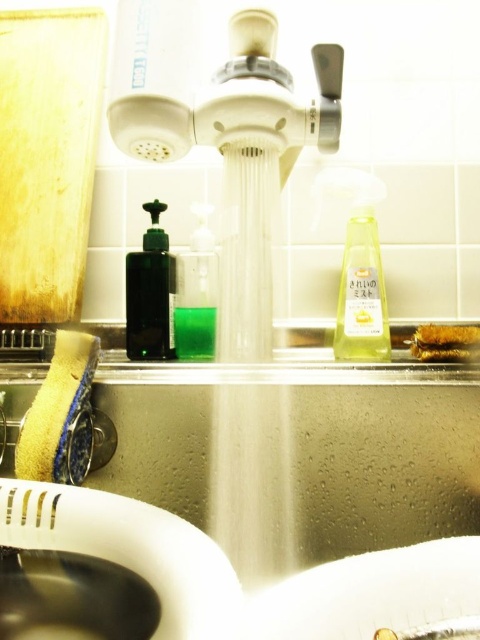
Question: Is metallic stainless steel sink at center above translucent yellow liquid at center?

Choices:
 (A) yes
 (B) no

Answer: (B)

Question: Can you confirm if translucent dark green bottle at center is thinner than green matte liquid at sink center?

Choices:
 (A) yes
 (B) no

Answer: (B)

Question: Which point is closer to the camera?

Choices:
 (A) pyautogui.click(x=157, y=528)
 (B) pyautogui.click(x=369, y=592)
 (C) pyautogui.click(x=199, y=216)

Answer: (B)

Question: Which point is farther to the camera?

Choices:
 (A) (193, 323)
 (B) (191, 326)

Answer: (B)

Question: Which object is the closest to the green translucent bottle at center?

Choices:
 (A) translucent dark green bottle at center
 (B) white glossy sink at lower left
 (C) metallic stainless steel sink at center
 (D) green matte liquid at sink center

Answer: (D)

Question: Is green translucent bottle at center to the left of green matte liquid at sink center from the viewer's perspective?

Choices:
 (A) yes
 (B) no

Answer: (A)